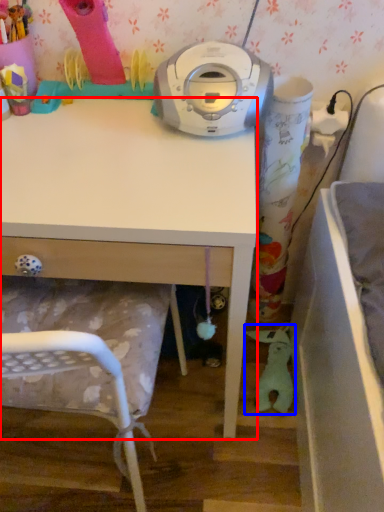
Question: Which object is further to the camera taking this photo, desk (highlighted by a red box) or toy (highlighted by a blue box)?

Choices:
 (A) desk
 (B) toy

Answer: (B)